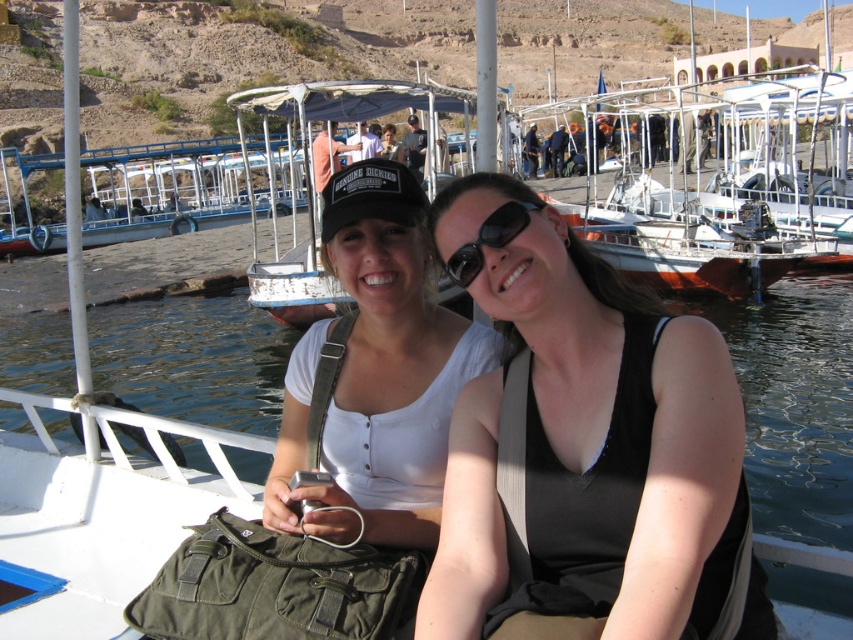
You are a photographer trying to capture a clear shot of both the white fabric tank top at center and the white wooden boat at center. Which object should you focus on first to ensure it appears sharp in the photo?

You should focus on the white fabric tank top at center first because it is closer to the viewer than the white wooden boat at center, so focusing on the closer object ensures it remains sharp while the background may blur slightly.